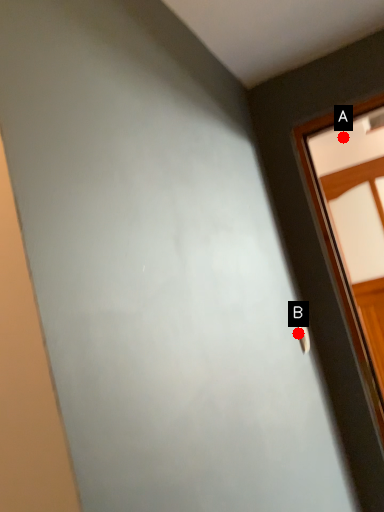
Question: Two points are circled on the image, labeled by A and B beside each circle. Which point is closer to the camera taking this photo?

Choices:
 (A) A is closer
 (B) B is closer

Answer: (B)